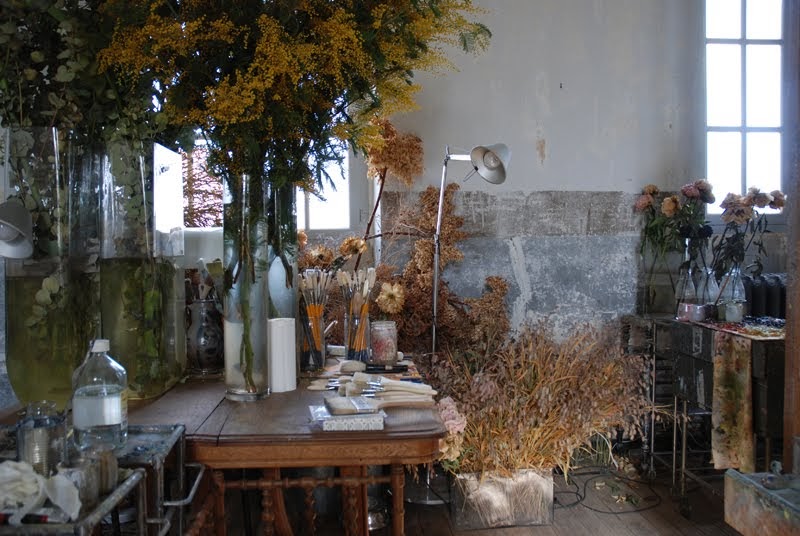
At what (x,y) coordinates should I click in order to perform the action: click on bulb. Please return your answer as a coordinate pair (x, y). Looking at the image, I should click on (490, 162).